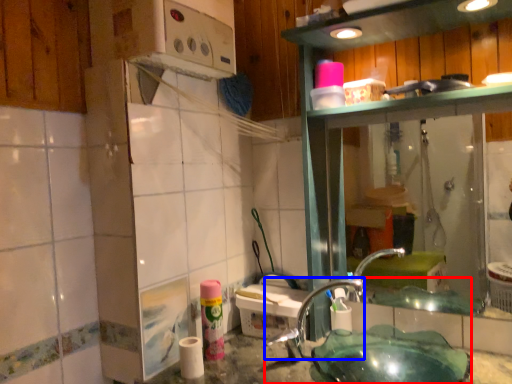
Question: Which object is closer to the camera taking this photo, sink (highlighted by a red box) or faucet (highlighted by a blue box)?

Choices:
 (A) sink
 (B) faucet

Answer: (A)